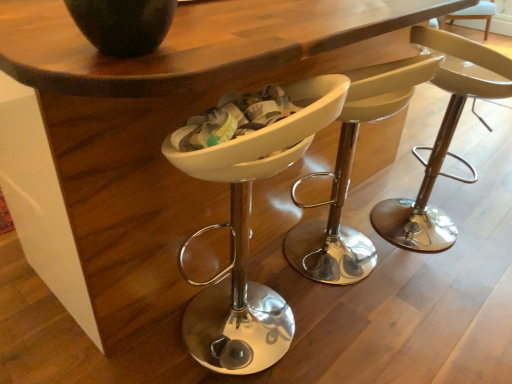
Where is `vacant space that's between matte beige stool at center, the third chair when ordered from left to right, and white plastic chair at center, the 2th chair when ordered from right to left`? This screenshot has height=384, width=512. vacant space that's between matte beige stool at center, the third chair when ordered from left to right, and white plastic chair at center, the 2th chair when ordered from right to left is located at coordinates (396, 264).